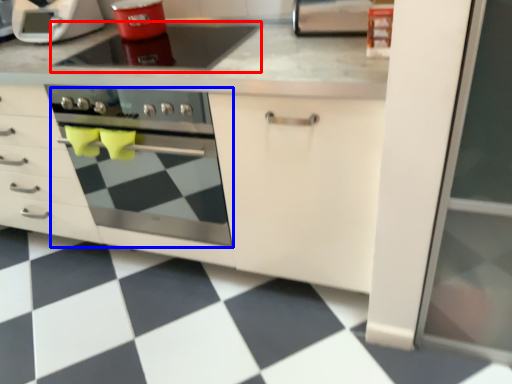
Question: Among these objects, which one is nearest to the camera, gas stove (highlighted by a red box) or oven (highlighted by a blue box)?

Choices:
 (A) gas stove
 (B) oven

Answer: (B)